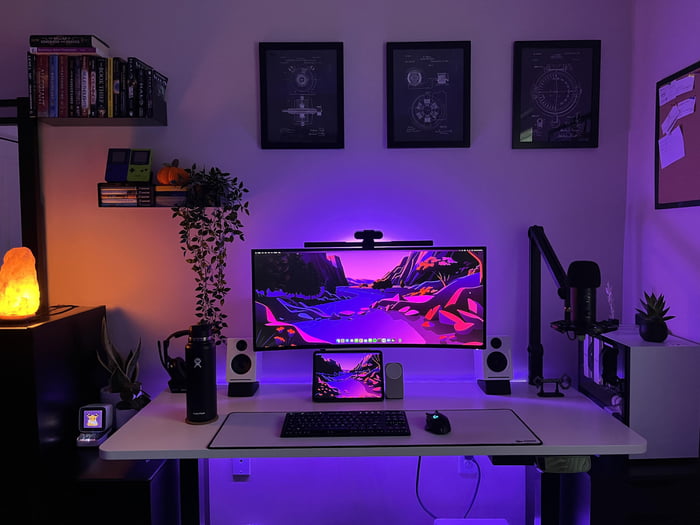
What are the coordinates of `speaker` in the screenshot? It's located at (250, 375), (486, 374), (395, 386).